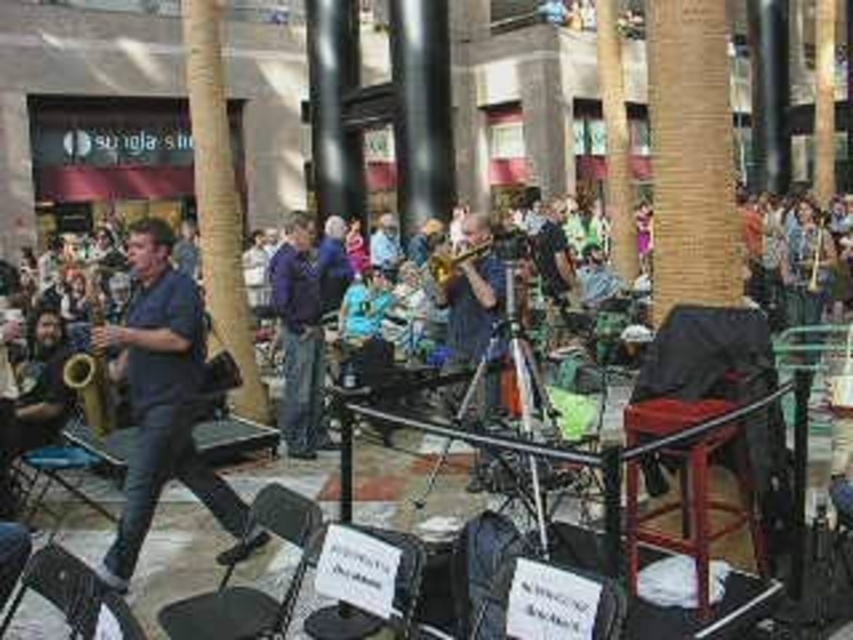
Question: Does black plastic chair at lower left appear over black leather chair at center?

Choices:
 (A) yes
 (B) no

Answer: (A)

Question: Does dark blue shirt at left appear on the right side of purple soft jacket at center?

Choices:
 (A) yes
 (B) no

Answer: (B)

Question: Which point is closer to the camera?

Choices:
 (A) (752, 372)
 (B) (320, 616)
 (C) (115, 611)

Answer: (C)

Question: Is dark blue shirt at left closer to the viewer compared to wooden chair at center?

Choices:
 (A) yes
 (B) no

Answer: (B)

Question: Which point appears closest to the camera in this image?

Choices:
 (A) (405, 536)
 (B) (184, 636)
 (C) (671, 390)

Answer: (A)

Question: Among these objects, which one is farthest from the camera?

Choices:
 (A) black leather chair at center
 (B) gold brass saxophone at left
 (C) purple soft jacket at center
 (D) metallic black chair at lower left

Answer: (C)